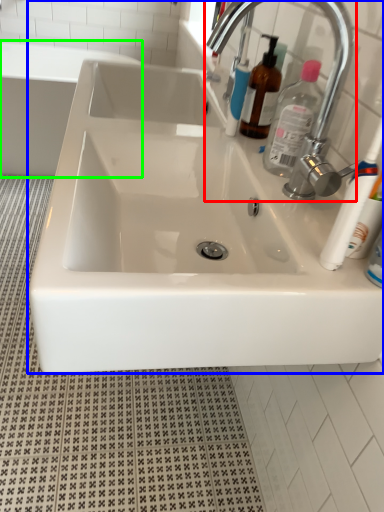
Question: Which object is positioned farthest from tap (highlighted by a red box)? Select from sink (highlighted by a blue box) and bath (highlighted by a green box).

Choices:
 (A) sink
 (B) bath

Answer: (B)